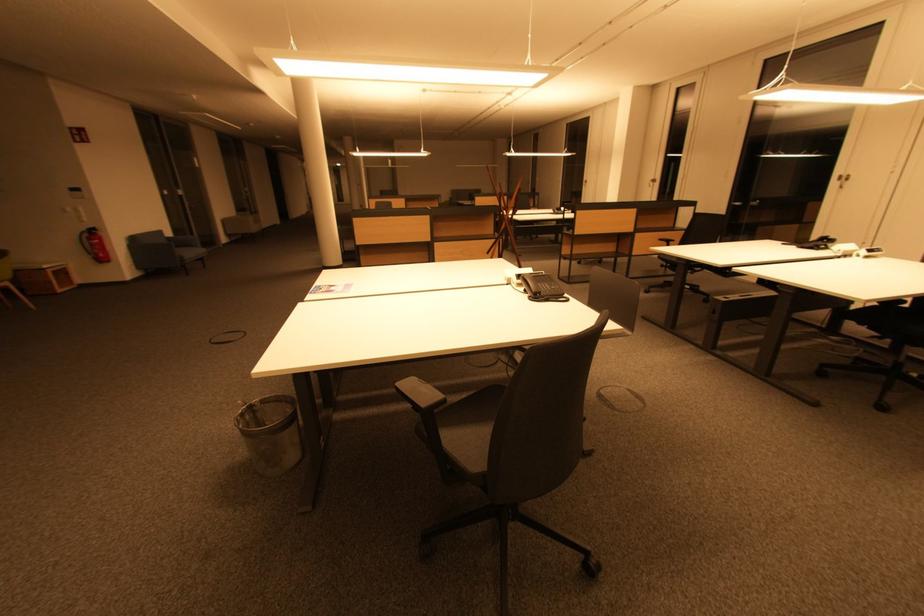
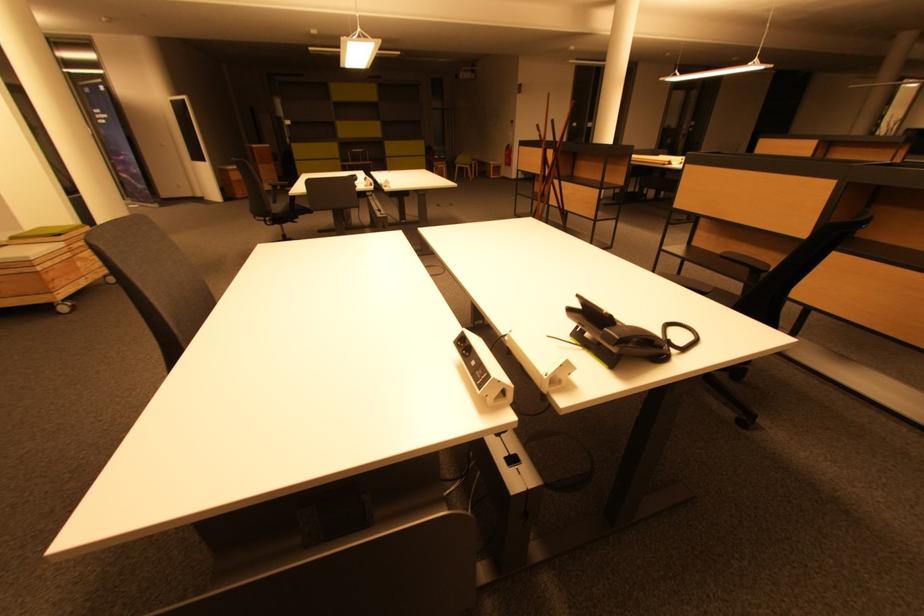
Where in the second image is the point corresponding to point 101,244 from the first image?

(512, 155)